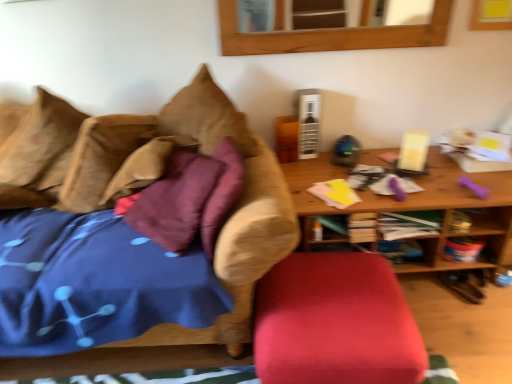
The width and height of the screenshot is (512, 384). What do you see at coordinates (330, 35) in the screenshot?
I see `wooden mirror at upper center` at bounding box center [330, 35].

I want to click on velvet red ottoman at lower center, so point(335,323).

Based on the photo, how much space does brown textured pillow at left, which appears as the first pillow when viewed from the left, occupy vertically?

It is 69.42 centimeters.

What is the approximate height of brown fabric couch at left?

28.86 inches.

Identify the location of wooden table at right. This screenshot has width=512, height=384. (418, 207).

From a real-world perspective, relative to wooden mirror at upper center, is velvet red ottoman at lower center vertically above or below?

In terms of real-world spatial position, velvet red ottoman at lower center is below wooden mirror at upper center.

You are a GUI agent. You are given a task and a screenshot of the screen. Output one action in this format:
    pyautogui.click(x=<x>, y=<y>)
    Task: Click on the swivel chair on the left of wooden mirror at upper center
    
    Given the screenshot: What is the action you would take?
    pyautogui.click(x=335, y=323)

Considering the relative sizes of velvet red ottoman at lower center and wooden mirror at upper center in the image provided, is velvet red ottoman at lower center bigger than wooden mirror at upper center?

Yes, velvet red ottoman at lower center is bigger than wooden mirror at upper center.

In terms of height, does velvet red ottoman at lower center look taller or shorter compared to wooden mirror at upper center?

velvet red ottoman at lower center is taller than wooden mirror at upper center.

Is wooden table at right completely or partially outside of brown fabric couch at left?

Yes, wooden table at right is located beyond the bounds of brown fabric couch at left.

Considering the positions of point (497, 174) and point (95, 161), is point (497, 174) closer or farther from the camera than point (95, 161)?

Point (497, 174) is farther from the camera than point (95, 161).

Considering the sizes of wooden table at right and brown fabric couch at left in the image, is wooden table at right wider or thinner than brown fabric couch at left?

wooden table at right is thinner than brown fabric couch at left.

Can you confirm if wooden table at right is positioned to the left of brown fabric couch at left?

No, wooden table at right is not to the left of brown fabric couch at left.

Is brown textured pillow at left, the second pillow from the right, located outside wooden mirror at upper center?

Yes, brown textured pillow at left, the second pillow from the right, is located beyond the bounds of wooden mirror at upper center.

From the image's perspective, would you say brown textured pillow at left, which appears as the first pillow when viewed from the left, is shown under wooden mirror at upper center?

Correct, brown textured pillow at left, which appears as the first pillow when viewed from the left, appears lower than wooden mirror at upper center in the image.

From their relative heights in the image, would you say brown textured pillow at left, the second pillow from the right, is taller or shorter than wooden mirror at upper center?

In the image, brown textured pillow at left, the second pillow from the right, appears to be taller than wooden mirror at upper center.

Can you confirm if brown textured pillow at left, which appears as the first pillow when viewed from the left, is positioned to the left of wooden mirror at upper center?

Indeed, brown textured pillow at left, which appears as the first pillow when viewed from the left, is positioned on the left side of wooden mirror at upper center.

From a real-world perspective, is brown suede pillow at upper left, marked as the 1th pillow in a right-to-left arrangement, over brown textured pillow at left, the second pillow from the right?

Incorrect, from a real-world perspective, brown suede pillow at upper left, marked as the 1th pillow in a right-to-left arrangement, is lower than brown textured pillow at left, the second pillow from the right.

Looking at this image, is brown suede pillow at upper left, marked as the 1th pillow in a right-to-left arrangement, far from brown textured pillow at left, the second pillow from the right?

No, there isn't a large distance between brown suede pillow at upper left, marked as the 1th pillow in a right-to-left arrangement, and brown textured pillow at left, the second pillow from the right.

From the image's perspective, relative to brown textured pillow at left, which appears as the first pillow when viewed from the left, is brown suede pillow at upper left, which is counted as the 2th pillow, starting from the left, above or below?

Based on their image positions, brown suede pillow at upper left, which is counted as the 2th pillow, starting from the left, is located beneath brown textured pillow at left, which appears as the first pillow when viewed from the left.

Who is bigger, brown suede pillow at upper left, which is counted as the 2th pillow, starting from the left, or velvet red ottoman at lower center?

velvet red ottoman at lower center is bigger.

Is brown suede pillow at upper left, marked as the 1th pillow in a right-to-left arrangement, oriented towards velvet red ottoman at lower center?

No, brown suede pillow at upper left, marked as the 1th pillow in a right-to-left arrangement, is not aimed at velvet red ottoman at lower center.

Would you say brown suede pillow at upper left, marked as the 1th pillow in a right-to-left arrangement, is inside or outside velvet red ottoman at lower center?

brown suede pillow at upper left, marked as the 1th pillow in a right-to-left arrangement, is outside velvet red ottoman at lower center.

In the scene shown: Is velvet red ottoman at lower center next to brown textured pillow at left, the second pillow from the right?

They are not placed beside each other.

Considering the relative positions of velvet red ottoman at lower center and brown textured pillow at left, the second pillow from the right, in the image provided, is velvet red ottoman at lower center to the right of brown textured pillow at left, the second pillow from the right, from the viewer's perspective?

Yes.

Is point (451, 174) positioned behind point (279, 361)?

Yes, it is.

Looking at the image, does wooden table at right seem bigger or smaller compared to velvet red ottoman at lower center?

In the image, wooden table at right appears to be larger than velvet red ottoman at lower center.

You are a GUI agent. You are given a task and a screenshot of the screen. Output one action in this format:
    pyautogui.click(x=<x>, y=<y>)
    Task: Click on the swivel chair located in front of the wooden table at right
    The image size is (512, 384).
    Given the screenshot: What is the action you would take?
    click(335, 323)

Find the location of a particular element. This screenshot has height=384, width=512. swivel chair below the wooden mirror at upper center (from the image's perspective) is located at coordinates (335, 323).

I want to click on studio couch above the wooden table at right (from a real-world perspective), so click(x=134, y=225).

Looking at the image, which one is located further to brown textured pillow at left, which appears as the first pillow when viewed from the left, brown suede pillow at upper left, marked as the 1th pillow in a right-to-left arrangement, or velvet red ottoman at lower center?

The object further to brown textured pillow at left, which appears as the first pillow when viewed from the left, is velvet red ottoman at lower center.

Which object lies further to the anchor point wooden table at right, velvet red ottoman at lower center or brown suede pillow at upper left, which is counted as the 2th pillow, starting from the left?

brown suede pillow at upper left, which is counted as the 2th pillow, starting from the left, lies further to wooden table at right than the other object.

Looking at the image, which one is located closer to brown textured pillow at left, which appears as the first pillow when viewed from the left, wooden mirror at upper center or velvet red ottoman at lower center?

wooden mirror at upper center is positioned closer to the anchor brown textured pillow at left, which appears as the first pillow when viewed from the left.

From the image, which object appears to be farther from brown textured pillow at left, the second pillow from the right, brown suede pillow at upper left, marked as the 1th pillow in a right-to-left arrangement, or wooden table at right?

wooden table at right is positioned further to the anchor brown textured pillow at left, the second pillow from the right.

Considering their positions, is brown textured pillow at left, which appears as the first pillow when viewed from the left, positioned closer to brown suede pillow at upper left, marked as the 1th pillow in a right-to-left arrangement, than velvet red ottoman at lower center?

brown textured pillow at left, which appears as the first pillow when viewed from the left, is positioned closer to the anchor brown suede pillow at upper left, marked as the 1th pillow in a right-to-left arrangement.

Looking at the image, which one is located further to wooden table at right, brown suede pillow at upper left, marked as the 1th pillow in a right-to-left arrangement, or brown fabric couch at left?

brown suede pillow at upper left, marked as the 1th pillow in a right-to-left arrangement, is positioned further to the anchor wooden table at right.

When comparing their distances from wooden table at right, does wooden mirror at upper center or brown textured pillow at left, which appears as the first pillow when viewed from the left, seem closer?

Among the two, wooden mirror at upper center is located nearer to wooden table at right.

Consider the image. Considering their positions, is brown textured pillow at left, the second pillow from the right, positioned further to wooden table at right than brown suede pillow at upper left, which is counted as the 2th pillow, starting from the left?

brown textured pillow at left, the second pillow from the right, is positioned further to the anchor wooden table at right.

The height and width of the screenshot is (384, 512). In order to click on pillow between brown fabric couch at left and wooden mirror at upper center in the horizontal direction in this screenshot , I will do `click(101, 158)`.

This screenshot has height=384, width=512. In order to click on pillow between brown textured pillow at left, the second pillow from the right, and velvet red ottoman at lower center from left to right in this screenshot , I will do `click(101, 158)`.

This screenshot has height=384, width=512. I want to click on studio couch between wooden mirror at upper center and velvet red ottoman at lower center from top to bottom, so click(x=134, y=225).

Where is `studio couch located between brown textured pillow at left, which appears as the first pillow when viewed from the left, and velvet red ottoman at lower center in the left-right direction`? The width and height of the screenshot is (512, 384). studio couch located between brown textured pillow at left, which appears as the first pillow when viewed from the left, and velvet red ottoman at lower center in the left-right direction is located at coordinates (134, 225).